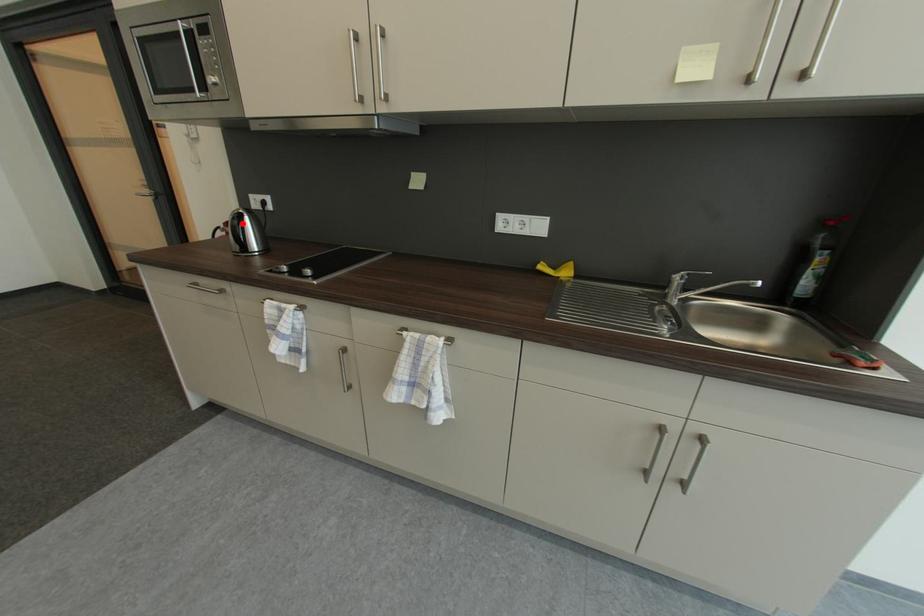
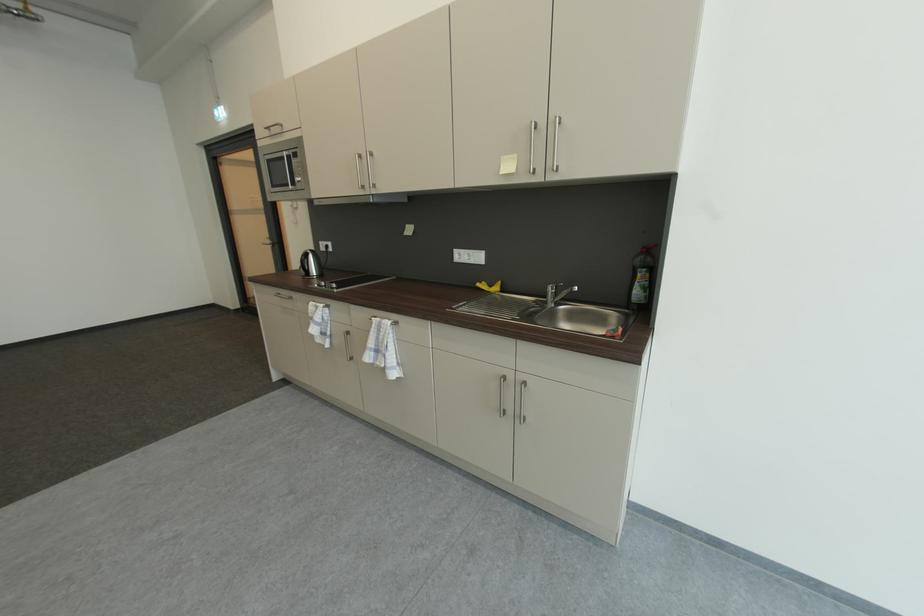
The point at the highlighted location is marked in the first image. Where is the corresponding point in the second image?

(310, 259)